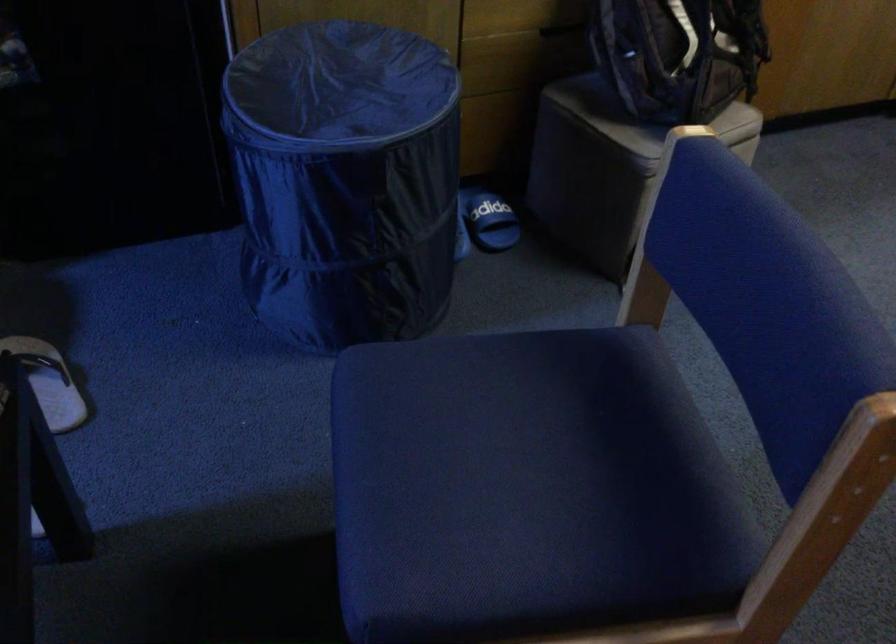
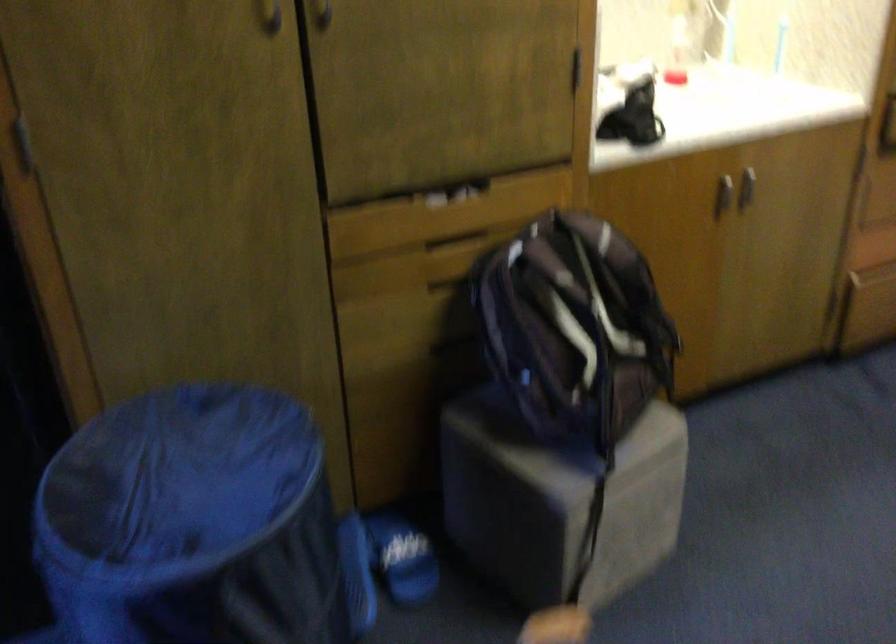
Question: How did the camera likely rotate?

Choices:
 (A) Left
 (B) Right
 (C) Up
 (D) Down

Answer: (C)